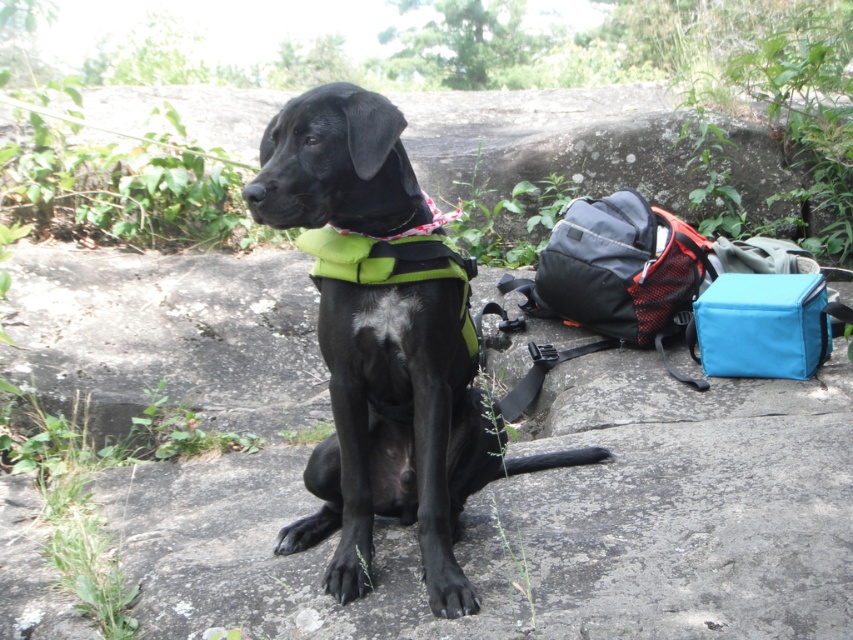
You are a photographer trying to capture the shiny black dog at center and the red plaid neckband at center in a single shot. Based on their positions, will the neckband be visible in the photo if you focus on the dog?

The shiny black dog at center is in front of the red plaid neckband at center, so if you focus on the dog, the neckband might be partially or fully obscured depending on their exact positions and the camera angle. However, since both are at the center, adjusting the framing slightly could ensure both are visible.

You are a photographer trying to capture the shiny black dog at center. Based on the coordinates provided, where should you position your camera to ensure the dog is centered in your shot?

The shiny black dog at center is located at the 2D coordinates point (x=397, y=426), so you should position your camera to center the shot at those coordinates to capture the dog in the center of the image.

You are a photographer trying to capture the shiny black dog at center and the red plaid neckband at center in a single frame. Based on their sizes, which object will appear larger in your photo?

The shiny black dog at center will appear larger in the photo because its width is larger than the red plaid neckband at center.